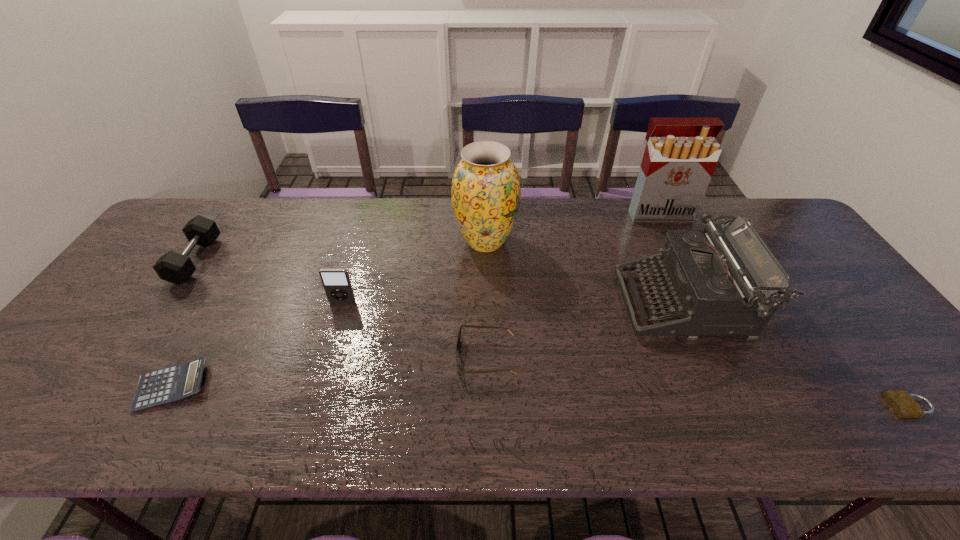
Identify the location of vacant space situated on the lenses of the sunglasses. The height and width of the screenshot is (540, 960). (427, 357).

Where is `vacant space situated 0.120m on the lenses of the sunglasses`? vacant space situated 0.120m on the lenses of the sunglasses is located at coordinates pos(406,357).

Image resolution: width=960 pixels, height=540 pixels. Identify the location of free location located on the back of the calculator. (250, 251).

This screenshot has width=960, height=540. I want to click on free space located on the keyhole side of the padlock, so click(770, 406).

Where is `free spot located 0.290m on the keyhole side of the padlock`? free spot located 0.290m on the keyhole side of the padlock is located at coordinates (756, 406).

Locate an element on the screen. This screenshot has width=960, height=540. vacant region located on the keyhole side of the padlock is located at coordinates (867, 406).

Where is `cigarette case that is at the far edge`? cigarette case that is at the far edge is located at coordinates (681, 154).

I want to click on vase located in the far edge section of the desktop, so click(x=486, y=191).

Where is `dumbbell at the far edge`? The image size is (960, 540). dumbbell at the far edge is located at coordinates (173, 267).

Identify the location of calculator located at the near edge. This screenshot has height=540, width=960. (174, 383).